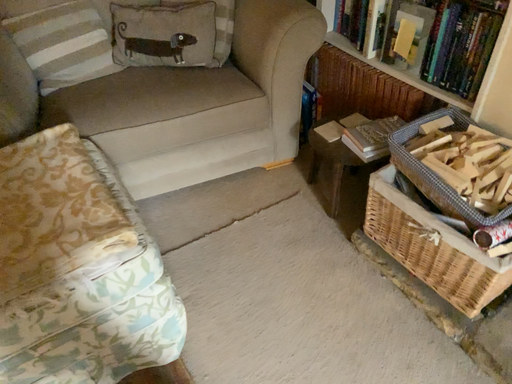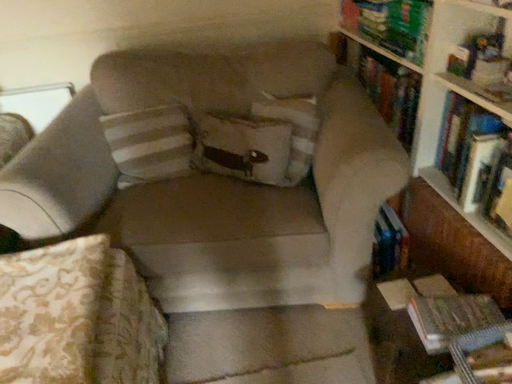
Question: Which way did the camera rotate in the video?

Choices:
 (A) rotated upward
 (B) rotated downward

Answer: (A)